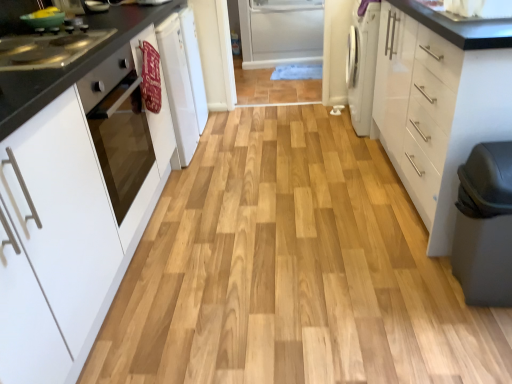
Question: Does white matte cabinet at left, which is counted as the 1th cabinetry, starting from the left, appear on the left side of white glossy oven at left?

Choices:
 (A) yes
 (B) no

Answer: (A)

Question: Does white matte cabinet at left, which appears as the second cabinetry when viewed from the right, lie behind white glossy oven at left?

Choices:
 (A) no
 (B) yes

Answer: (A)

Question: Could white glossy oven at left be considered to be inside white matte cabinet at left, which appears as the second cabinetry when viewed from the right?

Choices:
 (A) no
 (B) yes

Answer: (B)

Question: Would you consider white matte cabinet at left, which is counted as the 1th cabinetry, starting from the left, to be distant from white glossy oven at left?

Choices:
 (A) no
 (B) yes

Answer: (A)

Question: Does white matte cabinet at left, which appears as the second cabinetry when viewed from the right, come in front of white glossy oven at left?

Choices:
 (A) yes
 (B) no

Answer: (A)

Question: Is white matte cabinet at left, which is counted as the 1th cabinetry, starting from the left, situated inside white glossy cabinet at right, positioned as the second cabinetry in left-to-right order, or outside?

Choices:
 (A) outside
 (B) inside

Answer: (A)

Question: Relative to white glossy cabinet at right, positioned as the second cabinetry in left-to-right order, is white matte cabinet at left, which appears as the second cabinetry when viewed from the right, in front or behind?

Choices:
 (A) behind
 (B) front

Answer: (B)

Question: From a real-world perspective, is white matte cabinet at left, which is counted as the 1th cabinetry, starting from the left, physically located above or below white glossy cabinet at right, positioned as the second cabinetry in left-to-right order?

Choices:
 (A) above
 (B) below

Answer: (A)

Question: Is point click(x=27, y=264) positioned closer to the camera than point click(x=380, y=6)?

Choices:
 (A) closer
 (B) farther

Answer: (A)

Question: Is point (467, 11) positioned closer to the camera than point (128, 147)?

Choices:
 (A) farther
 (B) closer

Answer: (B)

Question: Is white glossy sink at upper right inside the boundaries of white glossy oven at left, or outside?

Choices:
 (A) outside
 (B) inside

Answer: (A)

Question: In terms of width, does white glossy sink at upper right look wider or thinner when compared to white glossy oven at left?

Choices:
 (A) wide
 (B) thin

Answer: (A)

Question: From a real-world perspective, is white glossy sink at upper right physically located above or below white glossy oven at left?

Choices:
 (A) below
 (B) above

Answer: (B)

Question: From the image's perspective, is white matte cabinet at left, which appears as the second cabinetry when viewed from the right, above or below black glossy countertop at left?

Choices:
 (A) below
 (B) above

Answer: (A)

Question: Would you say white matte cabinet at left, which appears as the second cabinetry when viewed from the right, is to the left or to the right of black glossy countertop at left in the picture?

Choices:
 (A) right
 (B) left

Answer: (B)